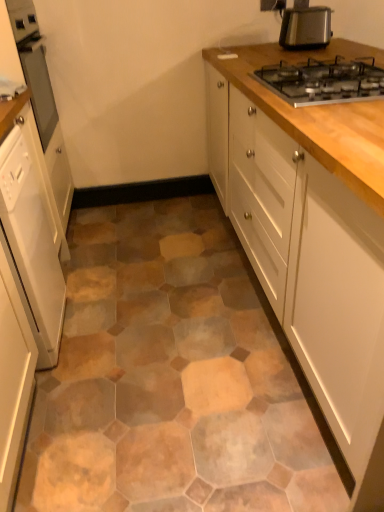
Where is `free space to the left of metallic silver toaster at upper right`? free space to the left of metallic silver toaster at upper right is located at coordinates (267, 48).